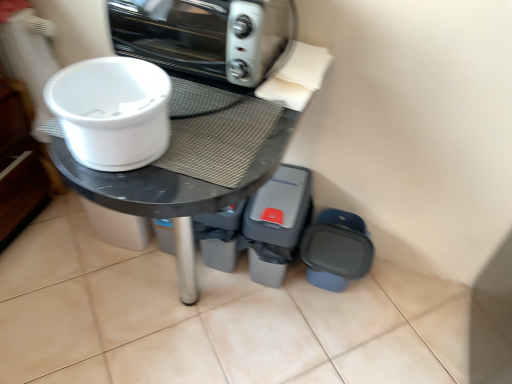
Question: Does matte black table at center appear on the left side of white plastic bowl at upper left?

Choices:
 (A) no
 (B) yes

Answer: (A)

Question: From the image's perspective, would you say matte black table at center is shown under white plastic bowl at upper left?

Choices:
 (A) yes
 (B) no

Answer: (A)

Question: Is matte black table at center aimed at white plastic bowl at upper left?

Choices:
 (A) no
 (B) yes

Answer: (A)

Question: Is matte black table at center thinner than white plastic bowl at upper left?

Choices:
 (A) no
 (B) yes

Answer: (A)

Question: Is white plastic bowl at upper left surrounded by matte black table at center?

Choices:
 (A) no
 (B) yes

Answer: (A)

Question: Is white plastic bowl at upper left at the back of matte black table at center?

Choices:
 (A) no
 (B) yes

Answer: (A)

Question: Considering the relative positions of white plastic bowl at upper left and gray plastic bin at lower right, which appears as the first appliance when viewed from the left, in the image provided, is white plastic bowl at upper left in front of gray plastic bin at lower right, which appears as the first appliance when viewed from the left,?

Choices:
 (A) no
 (B) yes

Answer: (B)

Question: From a real-world perspective, is white plastic bowl at upper left physically above gray plastic bin at lower right, which appears as the first appliance when viewed from the left?

Choices:
 (A) no
 (B) yes

Answer: (B)

Question: From the image's perspective, is white plastic bowl at upper left over gray plastic bin at lower right, which appears as the first appliance when viewed from the left?

Choices:
 (A) yes
 (B) no

Answer: (A)

Question: Is white plastic bowl at upper left smaller than gray plastic bin at lower right, which appears as the first appliance when viewed from the left?

Choices:
 (A) no
 (B) yes

Answer: (B)

Question: Is gray plastic bin at lower right, which appears as the first appliance when viewed from the left, a part of white plastic bowl at upper left?

Choices:
 (A) yes
 (B) no

Answer: (B)

Question: Can you confirm if white plastic bowl at upper left is taller than gray plastic bin at lower right, which appears as the first appliance when viewed from the left?

Choices:
 (A) yes
 (B) no

Answer: (B)

Question: Considering the relative sizes of metallic silver toaster oven at upper center and matte plastic container at lower right, the first appliance from the right, in the image provided, is metallic silver toaster oven at upper center taller than matte plastic container at lower right, the first appliance from the right,?

Choices:
 (A) no
 (B) yes

Answer: (A)